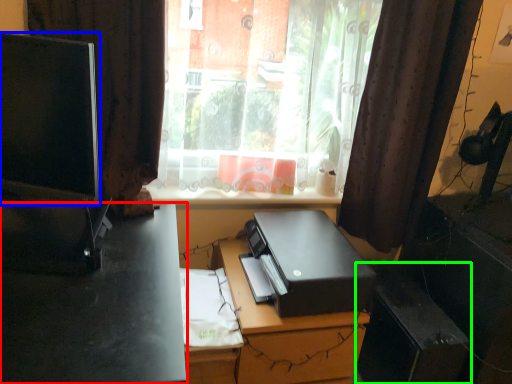
Question: Which object is positioned farthest from desk (highlighted by a red box)? Select from computer monitor (highlighted by a blue box) and file cabinet (highlighted by a green box).

Choices:
 (A) computer monitor
 (B) file cabinet

Answer: (B)